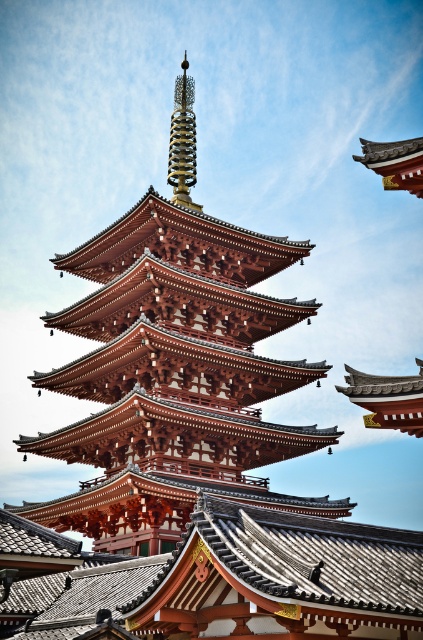
You are standing in front of the pagoda and notice two points marked on its structure. The first point is located at coordinates point (217, 445) and the second at point (181, 198). Which point is closer to you when facing the pagoda?

Point (217, 445) is in front of point (181, 198), so it is closer to you when facing the pagoda.

You are a visitor standing at the entrance of the pagoda complex. You notice the matte red pagoda at center and the gold spiral spire at center. Which one is closer to you?

The matte red pagoda at center is closer to you since it is in front of the gold spiral spire at center.